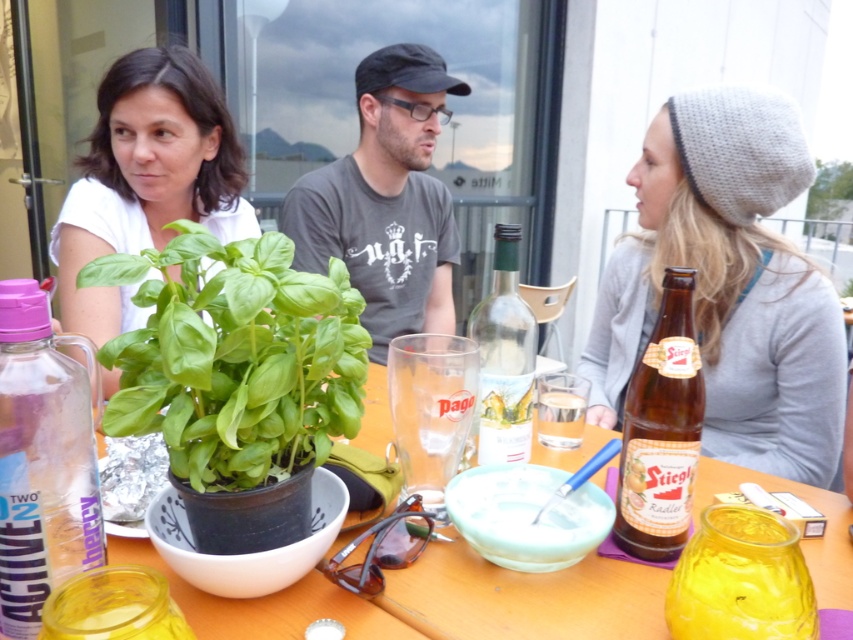
Between point (741, 145) and point (308, 598), which one is positioned behind?

Positioned behind is point (741, 145).

Can you confirm if knitted gray beanie at upper right is positioned to the left of wooden table at center?

In fact, knitted gray beanie at upper right is to the right of wooden table at center.

Image resolution: width=853 pixels, height=640 pixels. Describe the element at coordinates (728, 284) in the screenshot. I see `knitted gray beanie at upper right` at that location.

Locate an element on the screen. The image size is (853, 640). knitted gray beanie at upper right is located at coordinates (728, 284).

Does green leafy basil at center appear under brown glass bottle at right?

Incorrect, green leafy basil at center is not positioned below brown glass bottle at right.

Image resolution: width=853 pixels, height=640 pixels. Describe the element at coordinates (235, 356) in the screenshot. I see `green leafy basil at center` at that location.

What do you see at coordinates (235, 356) in the screenshot? I see `green leafy basil at center` at bounding box center [235, 356].

Where is `green leafy basil at center`? This screenshot has height=640, width=853. green leafy basil at center is located at coordinates (235, 356).

Based on the photo, can you confirm if translucent plastic jar at lower left is positioned to the right of clear glass at center?

No, translucent plastic jar at lower left is not to the right of clear glass at center.

Between translucent plastic jar at lower left and clear glass at center, which one appears on the right side from the viewer's perspective?

Positioned to the right is clear glass at center.

This screenshot has width=853, height=640. Find the location of `translucent plastic jar at lower left`. translucent plastic jar at lower left is located at coordinates (113, 605).